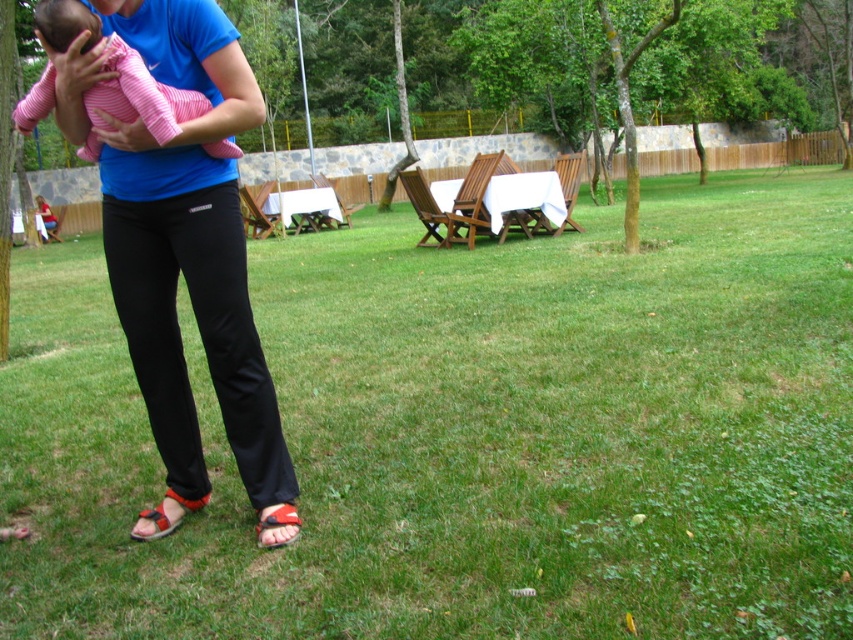
Question: Which object appears closest to the camera in this image?

Choices:
 (A) red leather sandal at lower center
 (B) matte black pants at center

Answer: (B)

Question: Which object is positioned farthest from the matte black pants at center?

Choices:
 (A) green grass at center
 (B) pink striped fabric baby at center
 (C) red leather sandal at lower center

Answer: (A)

Question: Is matte black pants at center below red leather sandal at lower left?

Choices:
 (A) no
 (B) yes

Answer: (A)

Question: From the image, what is the correct spatial relationship of pink striped fabric baby at center in relation to red leather sandal at lower left?

Choices:
 (A) above
 (B) below

Answer: (A)

Question: In this image, where is green grass at center located relative to pink striped fabric baby at center?

Choices:
 (A) left
 (B) right

Answer: (B)

Question: Which is farther from the red leather sandal at lower left?

Choices:
 (A) green grass at center
 (B) red leather sandal at lower center
 (C) matte black pants at center

Answer: (A)